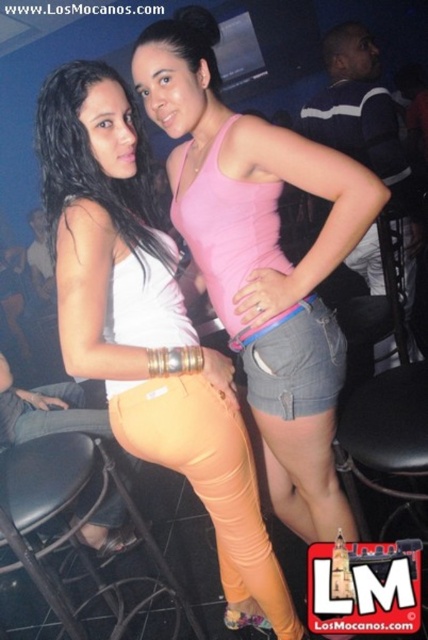
Question: Is pink matte tank top at center positioned in front of black leather bar stool at lower left?

Choices:
 (A) yes
 (B) no

Answer: (A)

Question: Is pink matte tank top at center smaller than matte white tank top at left?

Choices:
 (A) no
 (B) yes

Answer: (A)

Question: Which point is farther from the camera taking this photo?

Choices:
 (A) (158, 250)
 (B) (65, 307)
 (C) (365, 202)

Answer: (A)

Question: From the image, what is the correct spatial relationship of matte white tank top at center in relation to pink matte tank top at center?

Choices:
 (A) left
 (B) right

Answer: (A)

Question: Which of the following is the farthest from the observer?

Choices:
 (A) (85, 147)
 (B) (309, 317)
 (C) (38, 515)

Answer: (B)

Question: Which object is farther from the camera taking this photo?

Choices:
 (A) pink matte tank top at center
 (B) black leather bar stool at lower left

Answer: (B)